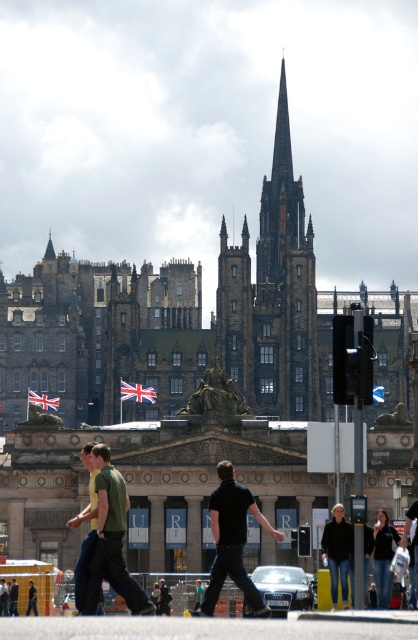
From the picture: Who is higher up, black matte shirt at center or dark green shirt at center?

black matte shirt at center is above.

Locate an element on the screen. This screenshot has width=418, height=640. black matte shirt at center is located at coordinates (231, 540).

I want to click on black matte shirt at center, so click(x=231, y=540).

Consider the image. Does dark blue jeans at center come behind dark green shirt at center?

No, dark blue jeans at center is closer to the viewer.

Is dark blue jeans at center wider than dark green shirt at center?

Yes, dark blue jeans at center is wider than dark green shirt at center.

Measure the distance between point (382, 600) and camera.

318.77 feet

Find the location of a particular element. This screenshot has height=640, width=418. dark blue jeans at center is located at coordinates (382, 557).

The image size is (418, 640). I want to click on green t-shirt at center, so click(x=111, y=538).

Is point (111, 522) positioned after point (237, 563)?

No, it is in front of (237, 563).

Measure the distance between green t-shirt at center and camera.

green t-shirt at center is 83.25 meters away from camera.

Locate an element on the screen. Image resolution: width=418 pixels, height=640 pixels. green t-shirt at center is located at coordinates (111, 538).